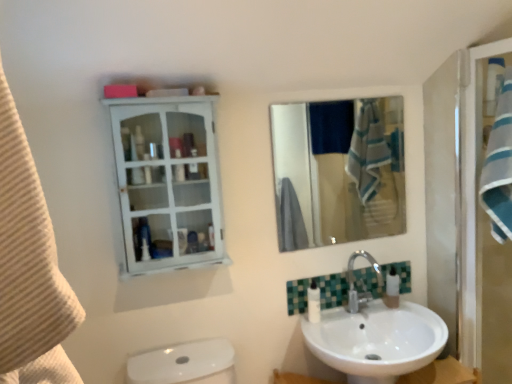
Identify the location of vacant space to the left of white plastic soap dispenser at lower right. The width and height of the screenshot is (512, 384). (365, 307).